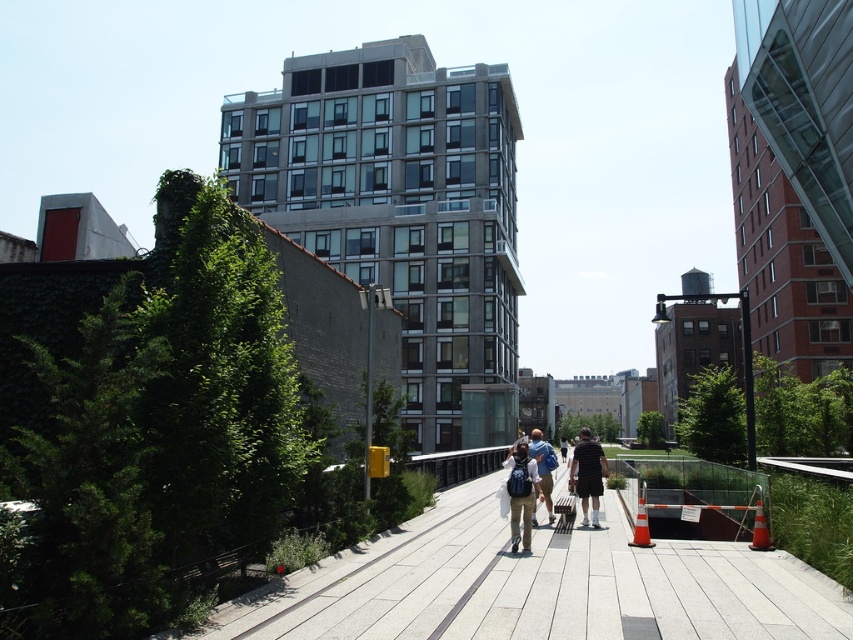
Question: Which is farther from the matte gray backpacks at center?

Choices:
 (A) white concrete pavement at center
 (B) dark gray shorts at center
 (C) matte blue backpack at center

Answer: (C)

Question: Does matte gray backpacks at center have a smaller size compared to dark gray shorts at center?

Choices:
 (A) no
 (B) yes

Answer: (A)

Question: Which object appears closest to the camera in this image?

Choices:
 (A) matte gray backpacks at center
 (B) matte black backpack at center

Answer: (B)

Question: Is the position of matte black backpack at center more distant than that of dark gray shorts at center?

Choices:
 (A) no
 (B) yes

Answer: (A)

Question: Is matte black backpack at center thinner than matte blue backpack at center?

Choices:
 (A) yes
 (B) no

Answer: (A)

Question: Which object is positioned farthest from the white concrete pavement at center?

Choices:
 (A) matte blue backpack at center
 (B) matte gray backpacks at center
 (C) matte black backpack at center
 (D) dark gray shorts at center

Answer: (C)